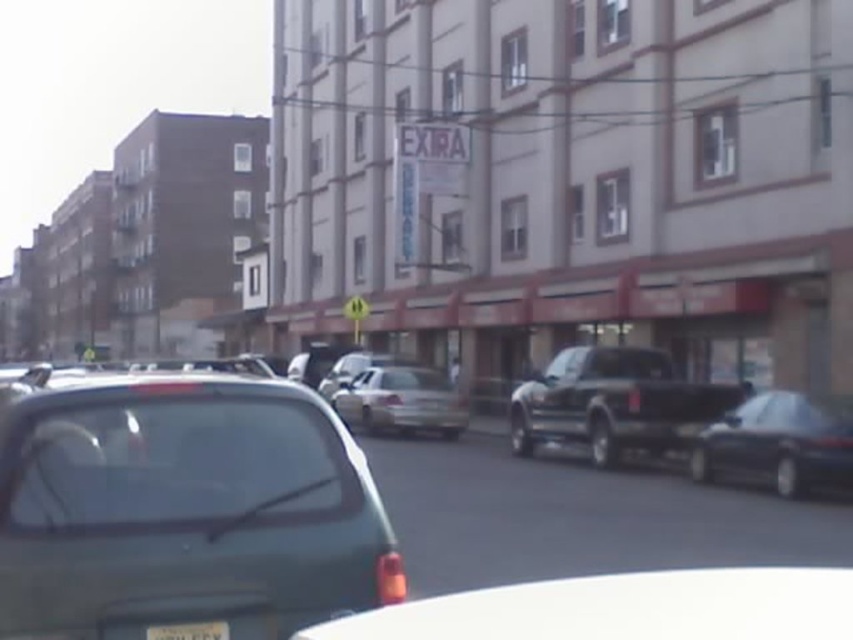
You are standing at the intersection observing the matte green car at center. Based on its position coordinates, can you determine if it is positioned closer to the front or the back of the street?

The matte green car at center is located at point coordinates, so it is positioned closer to the front of the street.

You are a delivery driver needing to park your vehicle between the matte green car at center and the black matte truck at center. Given that your vehicle is 1.8 meters tall, can you safely park there without hitting the roof?

The matte green car at center is not as tall as the black matte truck at center. Since the black matte truck at center is taller than the matte green car at center, and the height of the black matte truck at center is unknown, it is uncertain whether your vehicle can safely park there without hitting the roof.

You are a delivery driver who needs to park your truck between the matte green car at center and the silver metallic sedan at center. Your truck is 2 meters wide. Can you fit your truck between them?

The matte green car at center is narrower than the silver metallic sedan at center. However, the exact distance between them isn t specified in the provided information. Without knowing the space between the two cars, it s impossible to determine if the 2 meter wide truck can fit. More information about the gap between the cars is needed to answer this question accurately.